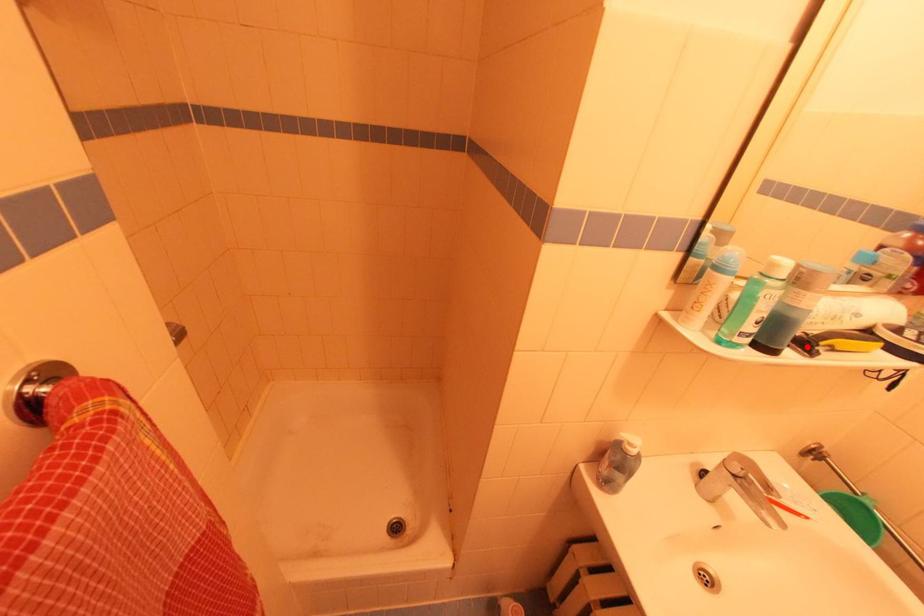
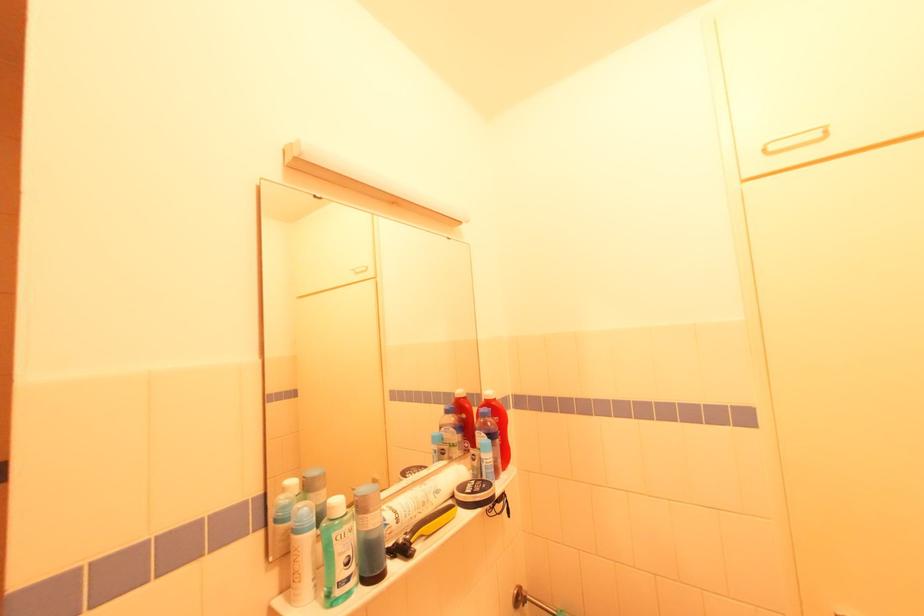
In the second image, find the point that corresponds to the highlighted location in the first image.

(406, 552)